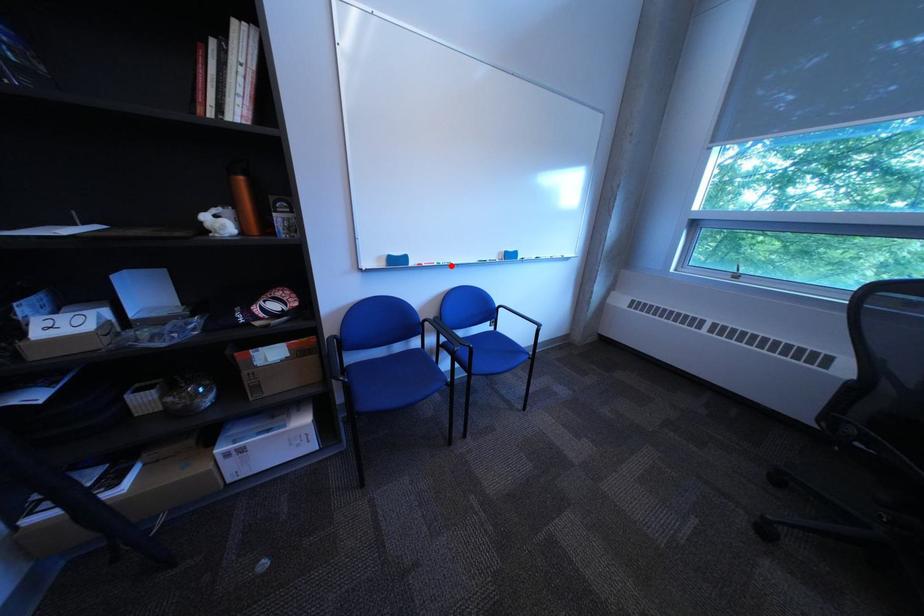
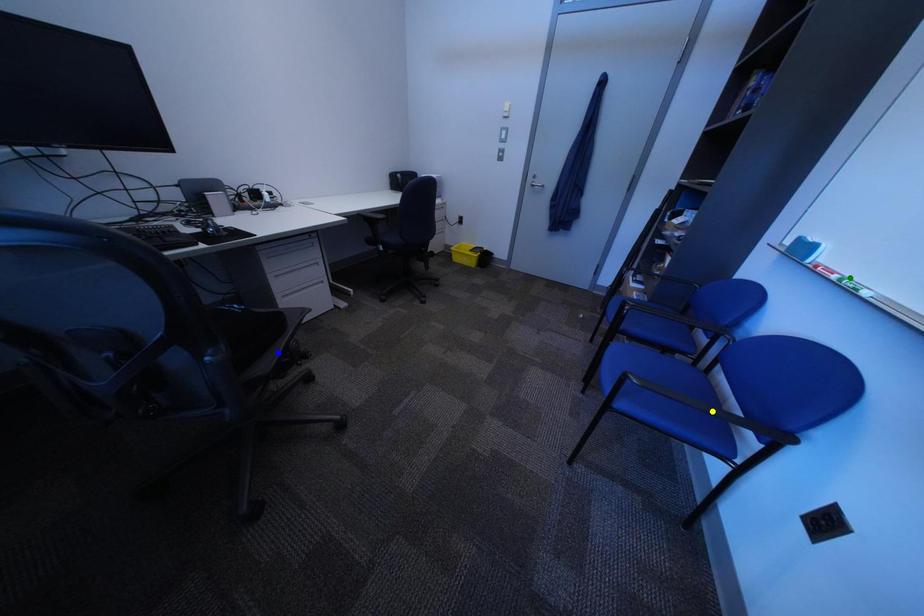
Question: I am providing you with two images of the same scene from different viewpoints. A red point is marked on the first image. You are given multiple points on the second image. In image 2, which mark is for the same physical point as the one in image 1?

Choices:
 (A) yellow point
 (B) green point
 (C) blue point

Answer: (B)